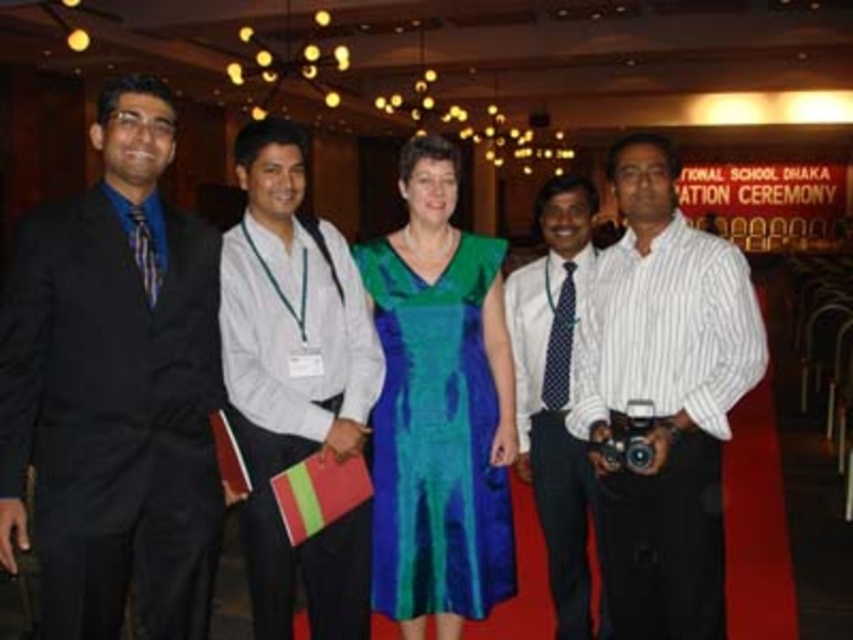
Question: Is matte black suit at left bigger than white dotted tie at center?

Choices:
 (A) no
 (B) yes

Answer: (B)

Question: Estimate the real-world distances between objects in this image. Which object is closer to the shiny satin dress at center?

Choices:
 (A) white cotton shirt at center
 (B) matte black suit at left
 (C) white dotted tie at center
 (D) white striped shirt at center

Answer: (A)

Question: Is matte black suit at left positioned behind white striped shirt at center?

Choices:
 (A) no
 (B) yes

Answer: (A)

Question: Which object appears closest to the camera in this image?

Choices:
 (A) matte black suit at left
 (B) white dotted tie at center
 (C) white cotton shirt at center

Answer: (A)

Question: Which object is closer to the camera taking this photo?

Choices:
 (A) shiny satin dress at center
 (B) white striped shirt at center
 (C) white dotted tie at center

Answer: (B)

Question: From the image, what is the correct spatial relationship of matte black suit at left in relation to shiny satin dress at center?

Choices:
 (A) above
 (B) below

Answer: (A)